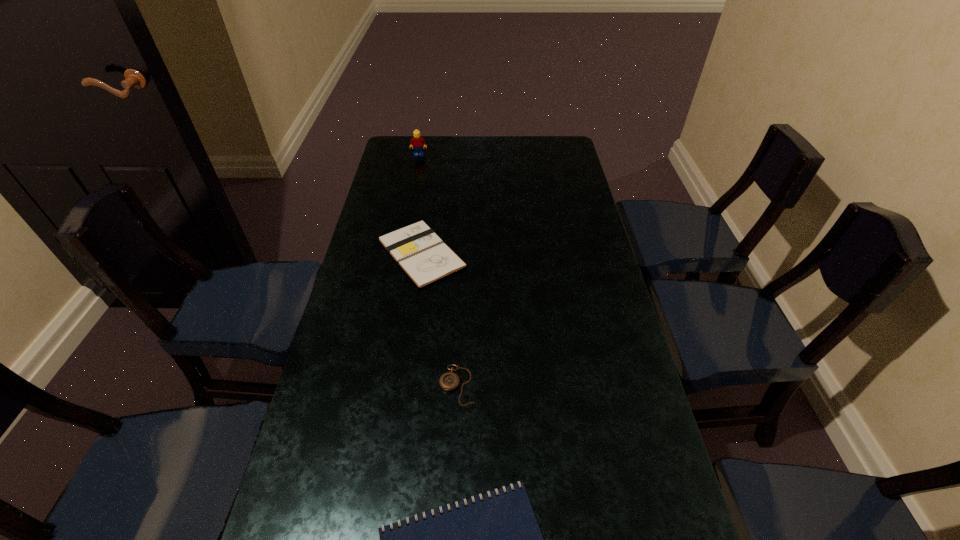
At what (x,y) coordinates should I click in order to perform the action: click on notepad that is at the left edge. Please return your answer as a coordinate pair (x, y). This screenshot has width=960, height=540. Looking at the image, I should click on (424, 257).

Identify the location of object that is at the far left corner. (417, 141).

At what (x,y) coordinates should I click in order to perform the action: click on free space at the far edge. Please return your answer as a coordinate pair (x, y). Looking at the image, I should click on click(x=512, y=146).

Locate an element on the screen. free location at the left edge of the desktop is located at coordinates (366, 503).

Identify the location of vacant space at the right edge. This screenshot has width=960, height=540. (575, 269).

This screenshot has height=540, width=960. I want to click on blank space at the far left corner of the desktop, so click(423, 148).

You are a GUI agent. You are given a task and a screenshot of the screen. Output one action in this format:
    pyautogui.click(x=<x>, y=<y>)
    Task: Click on the vacant area at the far right corner of the desktop
    The height and width of the screenshot is (540, 960).
    Given the screenshot: What is the action you would take?
    pyautogui.click(x=541, y=138)

I want to click on vacant region between the pocket watch and the third nearest object, so click(439, 319).

The width and height of the screenshot is (960, 540). Find the location of `free space between the pocket watch and the farther notepad`. free space between the pocket watch and the farther notepad is located at coordinates (439, 319).

The image size is (960, 540). I want to click on vacant space in between the tallest object and the farther notepad, so click(420, 204).